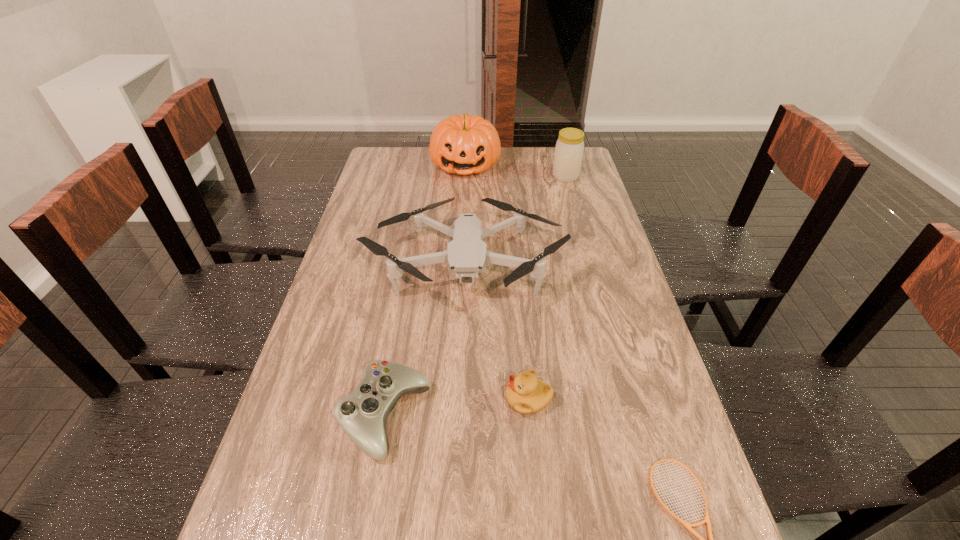
In order to click on pumpkin in this screenshot , I will do `click(465, 144)`.

Find the location of a particular element. jar is located at coordinates (569, 148).

Locate an element on the screen. This screenshot has height=540, width=960. drone is located at coordinates (467, 254).

This screenshot has height=540, width=960. What are the coordinates of `the fourth nearest object` in the screenshot? It's located at (467, 254).

This screenshot has width=960, height=540. Find the location of `control`. control is located at coordinates (362, 415).

Image resolution: width=960 pixels, height=540 pixels. Find the location of `duckling`. duckling is located at coordinates (525, 393).

Identify the location of free space located 0.180m on the carved face of the pumpkin. This screenshot has width=960, height=540. (464, 210).

I want to click on blank area located on the back of the jar, so pos(561,160).

You are a GUI agent. You are given a task and a screenshot of the screen. Output one action in this format:
    pyautogui.click(x=<x>, y=<y>)
    Task: Click on the free space located with a camera at the front of the fourth shortest object
    Image resolution: width=960 pixels, height=540 pixels.
    Given the screenshot: What is the action you would take?
    460,408

You are a GUI agent. You are given a task and a screenshot of the screen. Output one action in this format:
    pyautogui.click(x=<x>, y=<y>)
    Task: Click on the vacant point located 0.140m on the right of the control
    This screenshot has height=540, width=960.
    Given the screenshot: What is the action you would take?
    pyautogui.click(x=494, y=416)